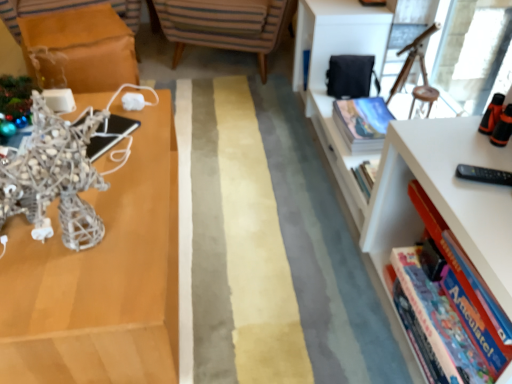
What are the coordinates of `hardcover book at upper right, the 1th book viewed from the back` in the screenshot? It's located at (362, 122).

At what (x,y) coordinates should I click in order to perform the action: click on hardcover book at right, arranged as the 2th book when viewed from the back. Please return your answer as a coordinate pair (x, y). The width and height of the screenshot is (512, 384). Looking at the image, I should click on (451, 256).

This screenshot has width=512, height=384. What do you see at coordinates (405, 154) in the screenshot? I see `white plastic bookcase at right` at bounding box center [405, 154].

The width and height of the screenshot is (512, 384). Find the location of `striped fabric chair at center`. striped fabric chair at center is located at coordinates (223, 25).

Locate an element on the screen. Image resolution: width=512 pixels, height=384 pixels. matte silver sculpture at left is located at coordinates (95, 266).

Find the location of a particular element. hardcover book at upper right, the second book in the bottom-to-top sequence is located at coordinates (362, 122).

Between hardcover book at right, the second book from the top, and striped fabric chair at center, which one has smaller width?

Thinner between the two is hardcover book at right, the second book from the top.

Based on the photo, is striped fabric chair at center at the back of hardcover book at right, which is the first book from front to back?

No.

Is hardcover book at right, which is the first book from front to back, completely or partially outside of striped fabric chair at center?

Yes, hardcover book at right, which is the first book from front to back, is not within striped fabric chair at center.

Can you confirm if hardcover book at right, arranged as the 2th book when viewed from the back, is shorter than striped fabric chair at center?

Indeed, hardcover book at right, arranged as the 2th book when viewed from the back, has a lesser height compared to striped fabric chair at center.

Is matte silver sculpture at left situated inside striped fabric chair at center or outside?

matte silver sculpture at left is not enclosed by striped fabric chair at center.

At what (x,y) coordinates should I click in order to perform the action: click on chair above the matte silver sculpture at left (from a real-world perspective). Please return your answer as a coordinate pair (x, y). Looking at the image, I should click on (223, 25).

From the image's perspective, which is below, matte silver sculpture at left or striped fabric chair at center?

matte silver sculpture at left.

Is matte silver sculpture at left taller or shorter than striped fabric chair at center?

Considering their sizes, matte silver sculpture at left has less height than striped fabric chair at center.

From the image's perspective, relative to hardcover book at right, which is the first book from front to back, is striped fabric chair at center above or below?

Clearly, from the image's perspective, striped fabric chair at center is above hardcover book at right, which is the first book from front to back.

Considering the relative sizes of striped fabric chair at center and hardcover book at right, arranged as the 2th book when viewed from the back, in the image provided, is striped fabric chair at center smaller than hardcover book at right, arranged as the 2th book when viewed from the back,?

Actually, striped fabric chair at center might be larger than hardcover book at right, arranged as the 2th book when viewed from the back.

Is striped fabric chair at center not inside hardcover book at right, which is the first book from front to back?

Yes.

How different are the orientations of striped fabric chair at center and hardcover book at right, the second book from the top, in degrees?

62.1 degrees separate the facing orientations of striped fabric chair at center and hardcover book at right, the second book from the top.

Who is more distant, hardcover book at right, arranged as the 2th book when viewed from the back, or hardcover book at upper right, the second book in the bottom-to-top sequence?

hardcover book at upper right, the second book in the bottom-to-top sequence, is further from the camera.

How different are the orientations of hardcover book at right, the first book in the bottom-to-top sequence, and hardcover book at upper right, the second book in the bottom-to-top sequence, in degrees?

The angular difference between hardcover book at right, the first book in the bottom-to-top sequence, and hardcover book at upper right, the second book in the bottom-to-top sequence, is 1.54 degrees.

Which object is positioned more to the left, hardcover book at right, the first book in the bottom-to-top sequence, or hardcover book at upper right, marked as the 1th book in a top-to-bottom arrangement?

hardcover book at upper right, marked as the 1th book in a top-to-bottom arrangement, is more to the left.

Is point (418, 197) closer to camera compared to point (370, 129)?

That is True.

Is white plastic bookcase at right looking in the opposite direction of hardcover book at upper right, the second book in the front-to-back sequence?

Yes.

Is white plastic bookcase at right surrounding hardcover book at upper right, the second book in the front-to-back sequence?

Yes, hardcover book at upper right, the second book in the front-to-back sequence, is surrounded by white plastic bookcase at right.

Is white plastic bookcase at right to the left of hardcover book at upper right, the second book in the bottom-to-top sequence, from the viewer's perspective?

No.

Is striped fabric chair at center not close to matte silver sculpture at left?

Yes, striped fabric chair at center is far from matte silver sculpture at left.

Can matte silver sculpture at left be found inside striped fabric chair at center?

No.

In the scene shown: Who is taller, striped fabric chair at center or matte silver sculpture at left?

striped fabric chair at center is taller.

Measure the distance from striped fabric chair at center to matte silver sculpture at left.

A distance of 4.58 feet exists between striped fabric chair at center and matte silver sculpture at left.

Which object is more forward, matte silver sculpture at left or matte brown table at left?

matte silver sculpture at left is in front.

Between matte silver sculpture at left and matte brown table at left, which one appears on the left side from the viewer's perspective?

Positioned to the left is matte brown table at left.

Considering the sizes of matte silver sculpture at left and matte brown table at left in the image, is matte silver sculpture at left bigger or smaller than matte brown table at left?

matte silver sculpture at left is smaller than matte brown table at left.

From a real-world perspective, starting from the striped fabric chair at center, which book is the 2nd one vertically above it? Please provide its 2D coordinates.

[(451, 256)]

Find the location of a particular element. chair behind the matte silver sculpture at left is located at coordinates (223, 25).

From the image, which object appears to be nearer to striped fabric chair at center, white plastic bookcase at right or hardcover book at right, the first book in the bottom-to-top sequence?

white plastic bookcase at right is closer to striped fabric chair at center.

Based on their spatial positions, is matte silver sculpture at left or white plastic bookcase at right closer to hardcover book at upper right, marked as the 1th book in a top-to-bottom arrangement?

white plastic bookcase at right.

Based on their spatial positions, is matte brown table at left or white plastic bookcase at right further from matte silver sculpture at left?

Based on the image, matte brown table at left appears to be further to matte silver sculpture at left.

Based on their spatial positions, is hardcover book at upper right, marked as the 1th book in a top-to-bottom arrangement, or striped fabric chair at center further from matte brown table at left?

hardcover book at upper right, marked as the 1th book in a top-to-bottom arrangement, lies further to matte brown table at left than the other object.

From the image, which object appears to be farther from matte brown table at left, striped fabric chair at center or hardcover book at right, which is the first book from front to back?

hardcover book at right, which is the first book from front to back, is positioned further to the anchor matte brown table at left.

When comparing their distances from matte silver sculpture at left, does white plastic bookcase at right or hardcover book at upper right, the second book in the bottom-to-top sequence, seem further?

hardcover book at upper right, the second book in the bottom-to-top sequence, is positioned further to the anchor matte silver sculpture at left.

Based on the photo, considering their positions, is matte silver sculpture at left positioned further to white plastic bookcase at right than matte brown table at left?

matte brown table at left is further to white plastic bookcase at right.

Considering their positions, is hardcover book at right, which is the first book from front to back, positioned further to matte silver sculpture at left than white plastic bookcase at right?

hardcover book at right, which is the first book from front to back, is positioned further to the anchor matte silver sculpture at left.

Identify the location of shelf between matte brown table at left and hardcover book at upper right, the second book in the bottom-to-top sequence. (95, 266).

This screenshot has height=384, width=512. I want to click on book located between matte silver sculpture at left and white plastic bookcase at right in the left-right direction, so click(x=362, y=122).

The height and width of the screenshot is (384, 512). Find the location of `book located between matte silver sculpture at left and hardcover book at right, arranged as the 2th book when viewed from the back, in the left-right direction`. book located between matte silver sculpture at left and hardcover book at right, arranged as the 2th book when viewed from the back, in the left-right direction is located at coordinates (362, 122).

Identify the location of chair positioned between white plastic bookcase at right and matte brown table at left from near to far. Image resolution: width=512 pixels, height=384 pixels. (223, 25).